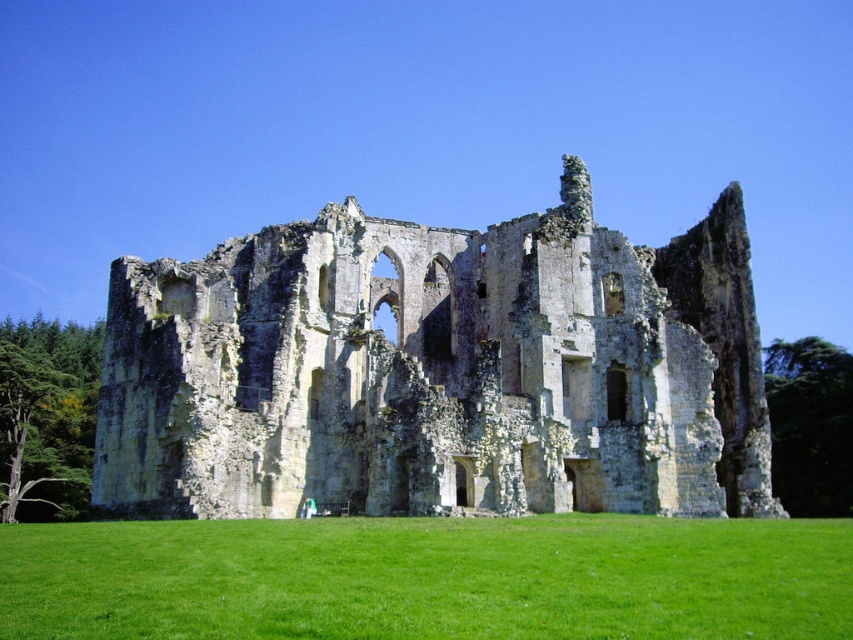
Question: Can you confirm if yellow stone ruins at center is smaller than green grass at center?

Choices:
 (A) yes
 (B) no

Answer: (B)

Question: Which of the following is the farthest from the observer?

Choices:
 (A) green grass at center
 (B) yellow stone ruins at center

Answer: (B)

Question: Among these points, which one is nearest to the camera?

Choices:
 (A) (27, 529)
 (B) (234, 326)

Answer: (A)

Question: Is yellow stone ruins at center positioned behind green grass at center?

Choices:
 (A) yes
 (B) no

Answer: (A)

Question: Does yellow stone ruins at center have a greater width compared to green grass at center?

Choices:
 (A) no
 (B) yes

Answer: (A)